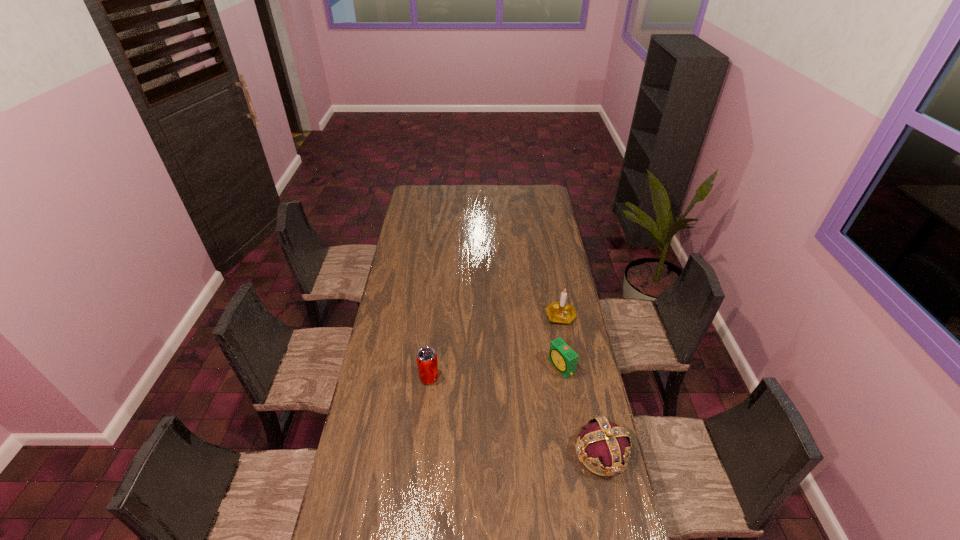
Identify the location of vacant space in between the soda can and the nearest object. The height and width of the screenshot is (540, 960). (516, 415).

At what (x,y) coordinates should I click in order to perform the action: click on vacant space that's between the leftmost object and the farthest object. Please return your answer as a coordinate pair (x, y). Looking at the image, I should click on (494, 347).

Identify the location of vacant space that's between the nearest object and the candle holder. The height and width of the screenshot is (540, 960). (581, 384).

Locate an element on the screen. The image size is (960, 540). vacant space that is in between the farthest object and the soda can is located at coordinates (494, 347).

The height and width of the screenshot is (540, 960). I want to click on free space between the leftmost object and the farthest object, so click(494, 347).

Locate an element on the screen. This screenshot has height=540, width=960. vacant area that lies between the soda can and the farthest object is located at coordinates (494, 347).

The height and width of the screenshot is (540, 960). I want to click on free spot between the nearest object and the alarm clock, so click(582, 410).

Locate an element on the screen. The image size is (960, 540). vacant point located between the shortest object and the leftmost object is located at coordinates (495, 372).

Identify the location of vacant point located between the leftmost object and the alarm clock. The image size is (960, 540). (495, 372).

Select which object appears as the third closest to the crown. Please provide its 2D coordinates. Your answer should be formatted as a tuple, i.e. [(x, y)], where the tuple contains the x and y coordinates of a point satisfying the conditions above.

[(427, 363)]